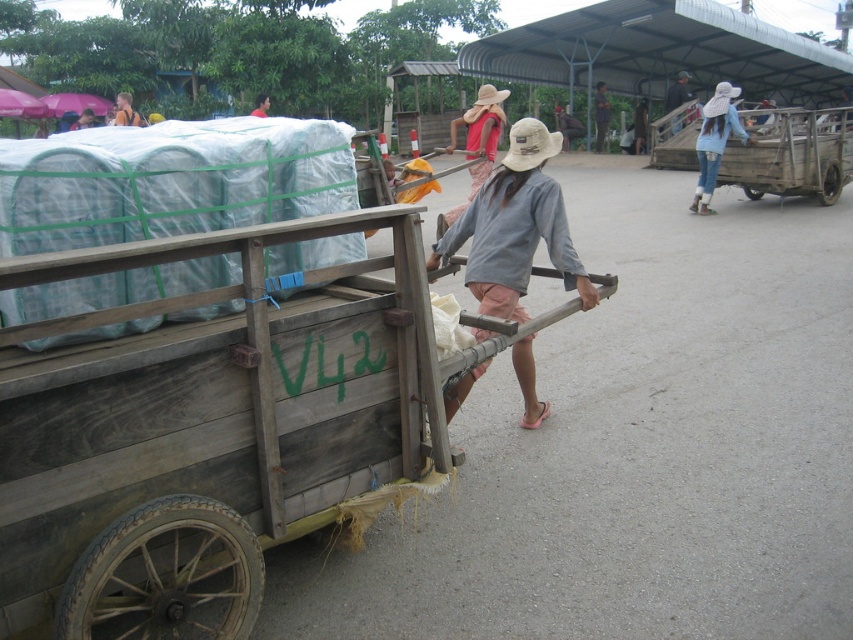
Does point (692, 204) come farther from viewer compared to point (645, 131)?

No, (692, 204) is closer to viewer.

Can you confirm if denim jacket at upper right is smaller than light blue fabric hat at center?

Correct, denim jacket at upper right occupies less space than light blue fabric hat at center.

Who is more distant from viewer, (724, 125) or (641, 124)?

Point (641, 124)

Where is `denim jacket at upper right`? The width and height of the screenshot is (853, 640). denim jacket at upper right is located at coordinates (714, 141).

Can you confirm if wooden cart at center is taller than denim jacket at upper right?

In fact, wooden cart at center may be shorter than denim jacket at upper right.

Does wooden cart at center have a smaller size compared to denim jacket at upper right?

No, wooden cart at center is not smaller than denim jacket at upper right.

Find the location of a particular element. wooden cart at center is located at coordinates (212, 429).

Locate an element on the screen. This screenshot has height=640, width=853. wooden cart at center is located at coordinates (212, 429).

Is matte beige hat at center below light brown skin at center?

Yes, matte beige hat at center is below light brown skin at center.

Is matte beige hat at center smaller than light brown skin at center?

No.

The width and height of the screenshot is (853, 640). I want to click on matte beige hat at center, so click(x=476, y=144).